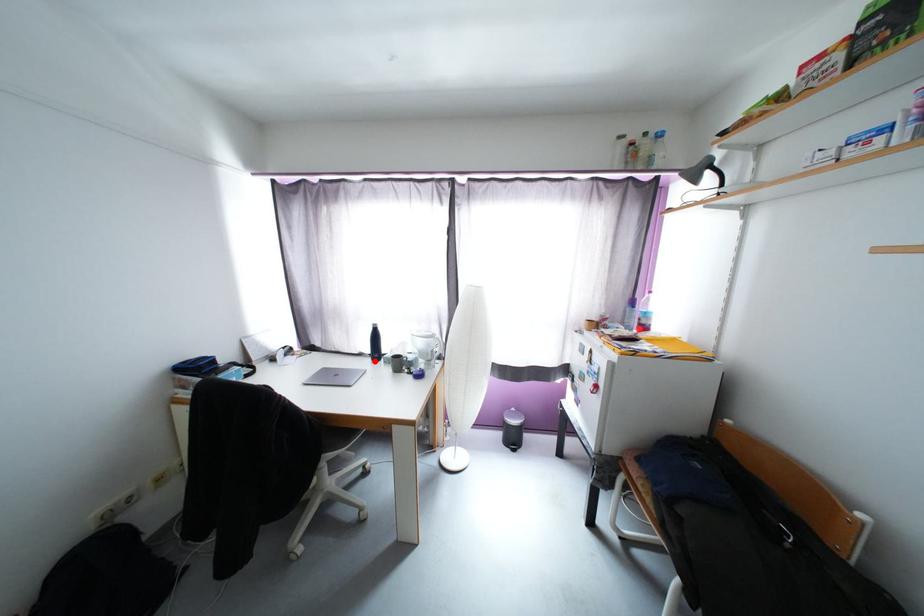
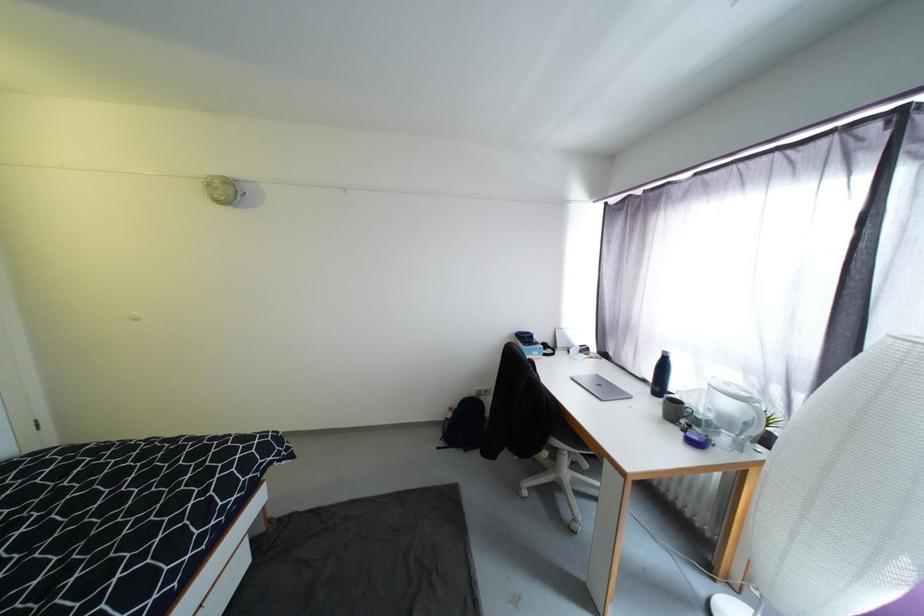
Question: I am providing you with two images of the same scene from different viewpoints. A red point is shown in image1. For the corresponding object point in image2, is it positioned nearer or farther from the camera?

Choices:
 (A) Nearer
 (B) Farther

Answer: (A)